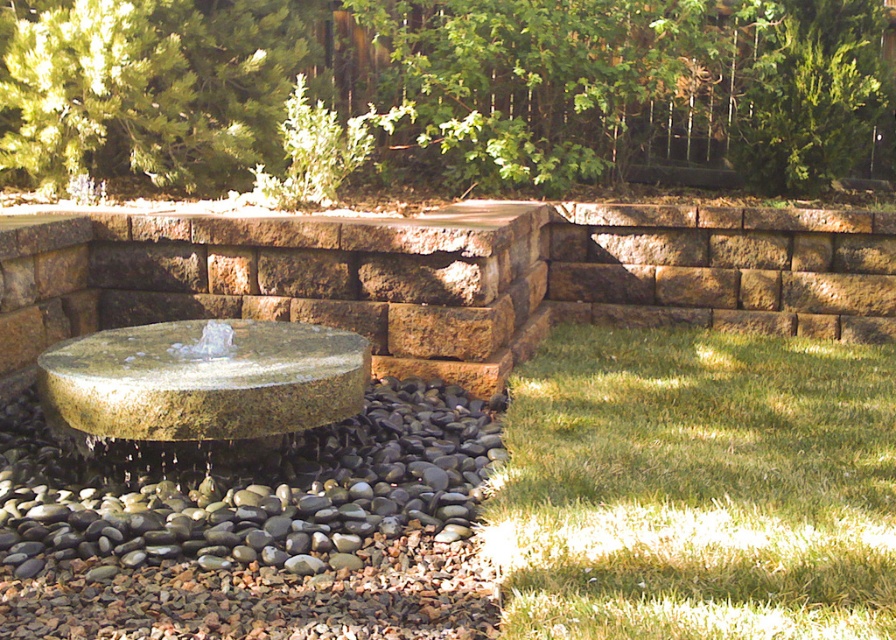
Is green stone wall at center taller than green stone fountain at center?

Yes, green stone wall at center is taller than green stone fountain at center.

Which of these two, green stone wall at center or green stone fountain at center, stands shorter?

Standing shorter between the two is green stone fountain at center.

Is point (300, 200) positioned before point (231, 380)?

That is False.

Find the location of a particular element. This screenshot has width=896, height=640. green stone wall at center is located at coordinates (448, 93).

Is green grass at lower right bigger than green stone fountain at center?

Indeed, green grass at lower right has a larger size compared to green stone fountain at center.

Between point (621, 560) and point (217, 397), which one is positioned in front?

Point (621, 560) is more forward.

This screenshot has height=640, width=896. I want to click on green grass at lower right, so click(696, 486).

Does green grass at lower right have a greater height compared to greenish-gray stone fountain at center?

Correct, green grass at lower right is much taller as greenish-gray stone fountain at center.

Does green grass at lower right appear on the right side of greenish-gray stone fountain at center?

Indeed, green grass at lower right is positioned on the right side of greenish-gray stone fountain at center.

Does point (814, 595) lie in front of point (263, 544)?

That is True.

This screenshot has height=640, width=896. What are the coordinates of `green grass at lower right` in the screenshot? It's located at (696, 486).